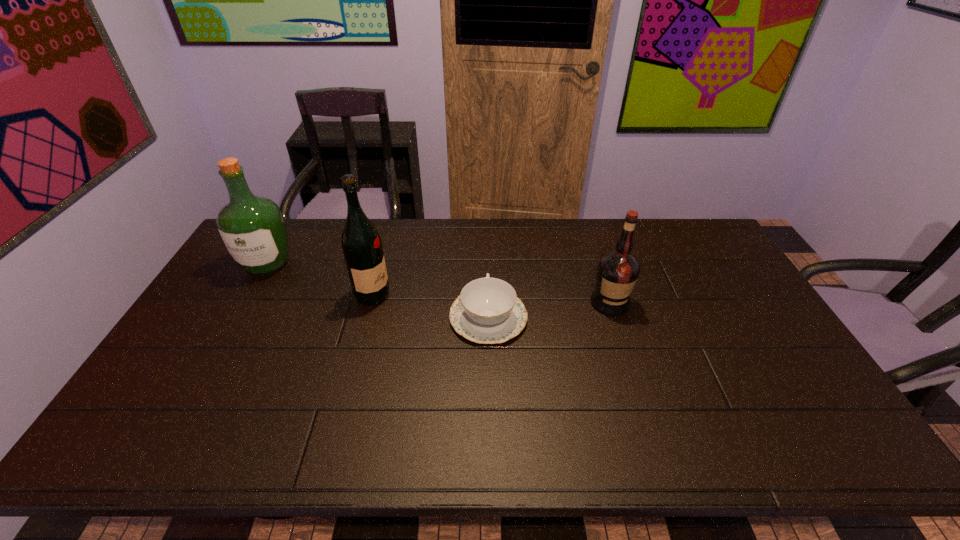
This screenshot has height=540, width=960. In the image, there is a desktop. Identify the location of vacant space at the far right corner. coord(673,240).

This screenshot has height=540, width=960. Find the location of `vacant space that's between the farthest object and the second object from left to right`. vacant space that's between the farthest object and the second object from left to right is located at coordinates (320, 279).

You are a GUI agent. You are given a task and a screenshot of the screen. Output one action in this format:
    pyautogui.click(x=<x>, y=<y>)
    Task: Click on the free spot between the shortest liquor and the farthest object
    
    Given the screenshot: What is the action you would take?
    pyautogui.click(x=439, y=283)

Identify the location of vacant point located between the farthest object and the second liquor from left to right. (320, 279).

The height and width of the screenshot is (540, 960). What are the coordinates of `blank region between the leftmost object and the shortest liquor` in the screenshot? It's located at (439, 283).

Where is `empty space between the leftmost object and the second liquor from left to right`? This screenshot has height=540, width=960. empty space between the leftmost object and the second liquor from left to right is located at coordinates (320, 279).

This screenshot has width=960, height=540. Identify the location of unoccupied position between the farthest liquor and the second shortest object. (439, 283).

The height and width of the screenshot is (540, 960). I want to click on vacant region between the farthest liquor and the rightmost liquor, so click(439, 283).

The image size is (960, 540). Find the location of `vacant area between the farthest liquor and the third object from right to left`. vacant area between the farthest liquor and the third object from right to left is located at coordinates (320, 279).

Select which object is the third closest to the second liquor from right to left. Please provide its 2D coordinates. Your answer should be formatted as a tuple, i.e. [(x, y)], where the tuple contains the x and y coordinates of a point satisfying the conditions above.

[(617, 272)]